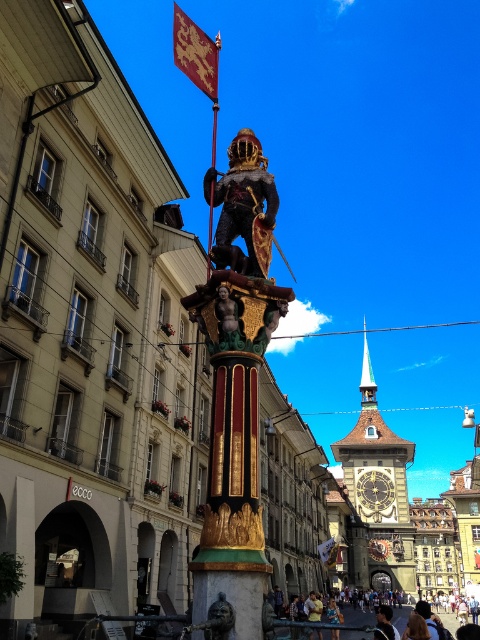
You are standing in the public square and want to take a photo of the statue. The statue is located at point (377, 472). If your camera has a maximum range of 500 feet, will you be able to capture the statue in your photo?

The point (377, 472) is 533.85 feet from the viewer, which exceeds the camera maximum range of 500 feet. Therefore, the statue cannot be captured in the photo.

You are an architect designing a new public square and want to ensure the gold metallic clock at center and the gold textured flag at center are visible from a distance. Which object will appear more prominent to someone standing far away?

The gold metallic clock at center is larger in size than the gold textured flag at center, so it will appear more prominent to someone standing far away.

You are an art student analyzing the statue in the square. You notice two statues labeled as the golden statue at center and the golden textured statue at center. Which one is taller?

The golden statue at center is taller than the golden textured statue at center.